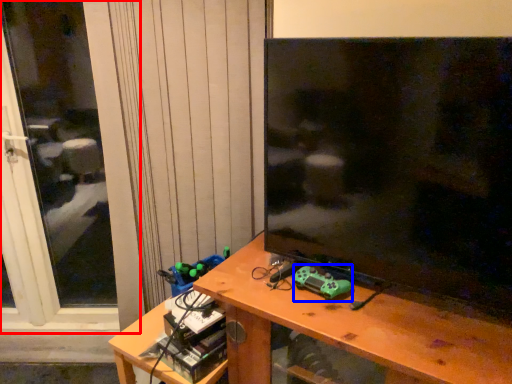
Question: Which object appears farthest to the camera in this image, screen door (highlighted by a red box) or toy (highlighted by a blue box)?

Choices:
 (A) screen door
 (B) toy

Answer: (A)